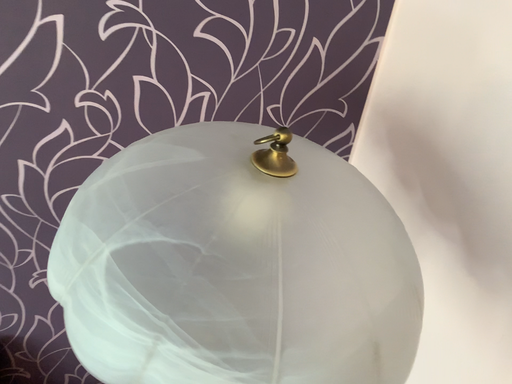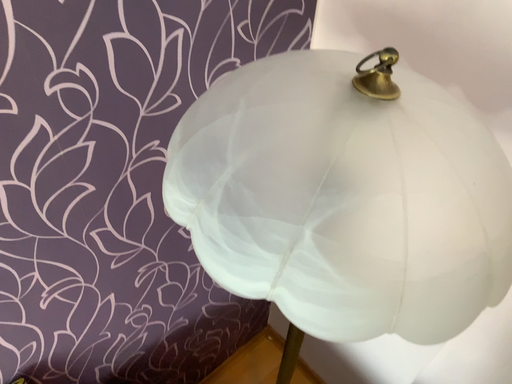
Question: How did the camera likely rotate when shooting the video?

Choices:
 (A) rotated downward
 (B) rotated upward

Answer: (A)